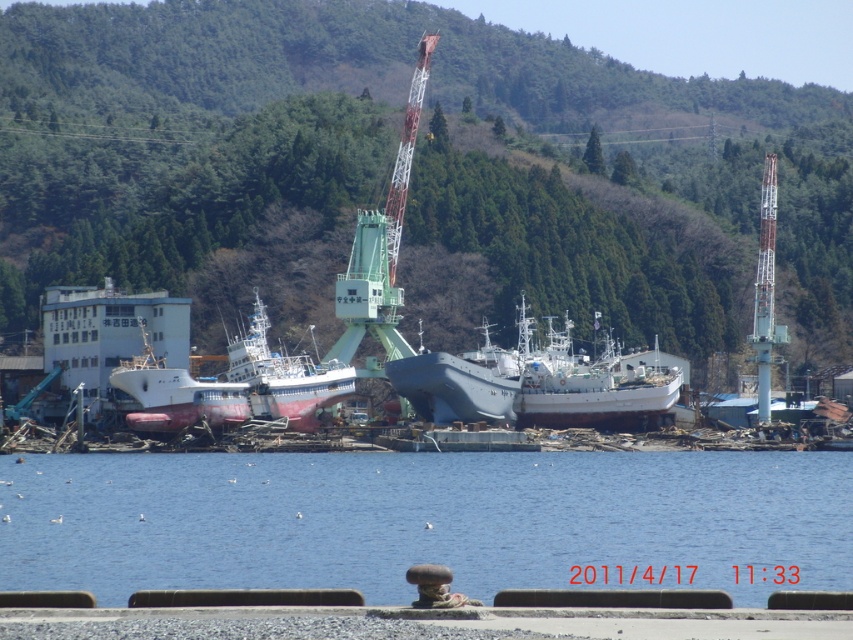
Question: Considering the real-world distances, which object is farthest from the blue metallic ship at center?

Choices:
 (A) green forested hillside at upper center
 (B) white matte boat at center

Answer: (A)

Question: Observing the image, what is the correct spatial positioning of green forested hillside at upper center in reference to white matte boat at center?

Choices:
 (A) right
 (B) left

Answer: (A)

Question: Is the position of blue water at center more distant than that of white matte boat at center?

Choices:
 (A) no
 (B) yes

Answer: (A)

Question: Can you confirm if blue water at center is wider than white matte boat at center?

Choices:
 (A) no
 (B) yes

Answer: (B)

Question: Among these objects, which one is farthest from the camera?

Choices:
 (A) blue metallic ship at center
 (B) blue water at center

Answer: (A)

Question: Among these points, which one is nearest to the camera?

Choices:
 (A) (178, 378)
 (B) (688, 275)
 (C) (480, 593)

Answer: (C)